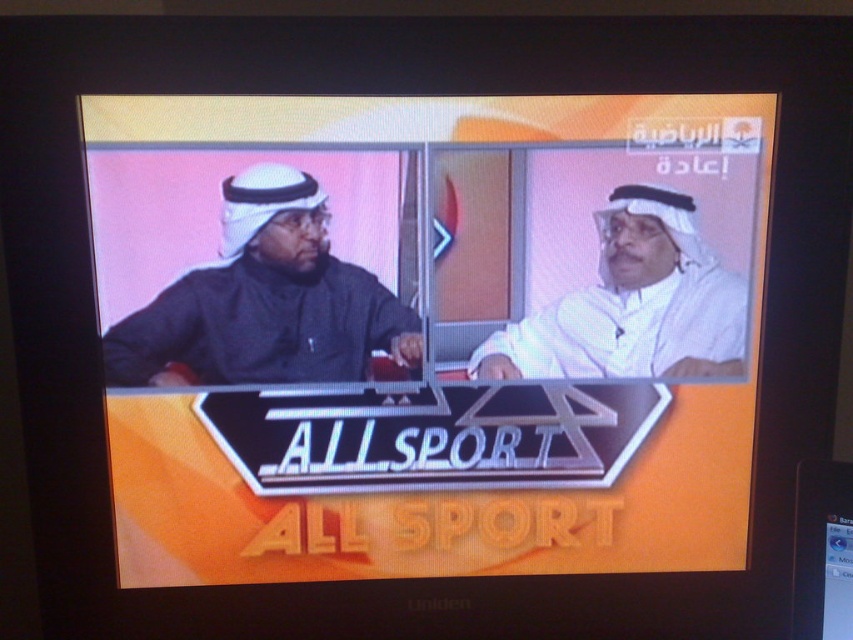
Question: Which object appears farthest from the camera in this image?

Choices:
 (A) black plastic flat at lower right
 (B) white matte headscarf at center

Answer: (B)

Question: Which point appears closest to the camera in this image?

Choices:
 (A) (790, 634)
 (B) (395, 321)

Answer: (B)

Question: Among these objects, which one is farthest from the camera?

Choices:
 (A) white matte headscarf at center
 (B) matte black robe at left

Answer: (A)

Question: Does matte black robe at left appear over white matte headscarf at center?

Choices:
 (A) no
 (B) yes

Answer: (B)

Question: Does matte black robe at left have a greater width compared to black plastic flat at lower right?

Choices:
 (A) yes
 (B) no

Answer: (A)

Question: Is matte black robe at left to the right of white matte headscarf at center from the viewer's perspective?

Choices:
 (A) yes
 (B) no

Answer: (B)